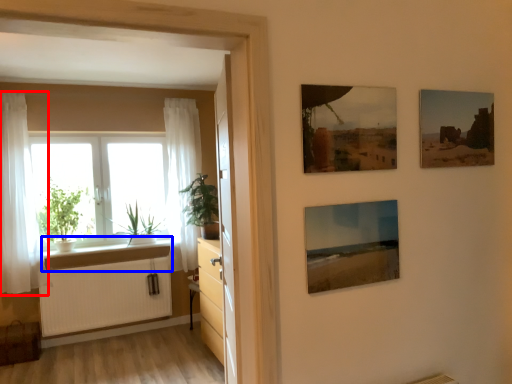
Question: Which object appears closest to the camera in this image, curtain (highlighted by a red box) or window sill (highlighted by a blue box)?

Choices:
 (A) curtain
 (B) window sill

Answer: (A)